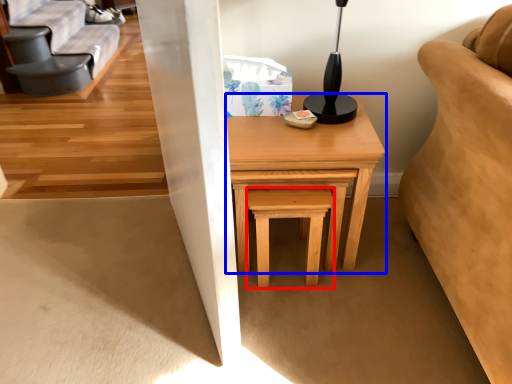
Question: Which point is closer to the camera, stool (highlighted by a red box) or table (highlighted by a blue box)?

Choices:
 (A) stool
 (B) table

Answer: (B)